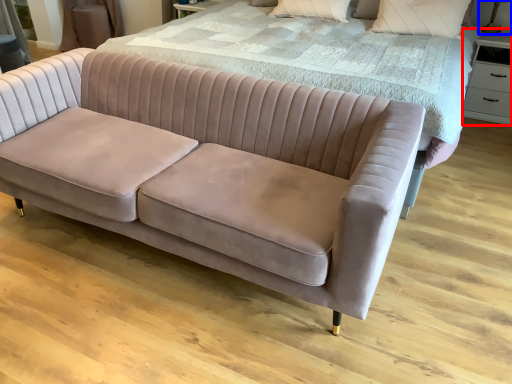
Question: Which of the following is the closest to the observer, side table (highlighted by a red box) or table lamp (highlighted by a blue box)?

Choices:
 (A) side table
 (B) table lamp

Answer: (A)